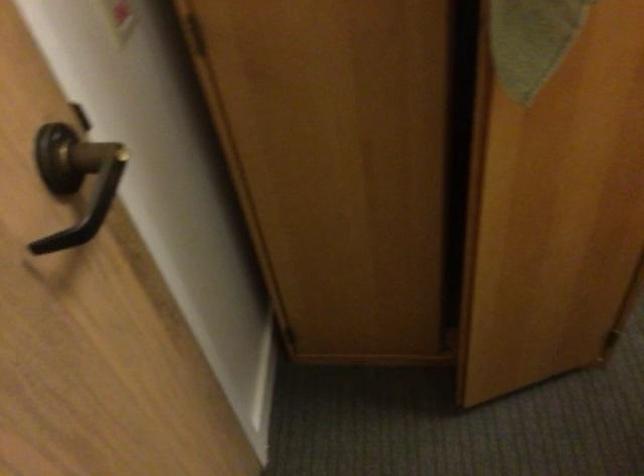
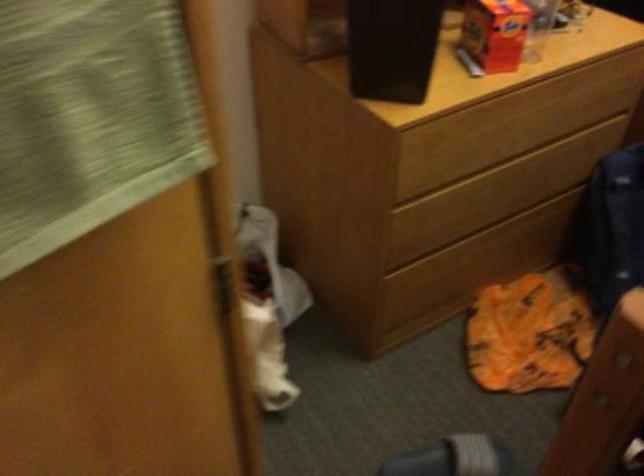
Question: The camera is either moving clockwise (left) or counter-clockwise (right) around the object. The first image is from the beginning of the video and the second image is from the end. Is the camera moving left or right when shooting the video?

Choices:
 (A) Left
 (B) Right

Answer: (A)